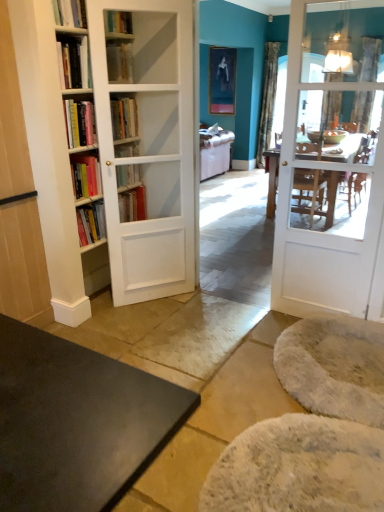
Question: From the image's perspective, is hardcover book at upper center above or below white fluffy yoga mat at lower right, positioned as the 1th yoga mat in back-to-front order?

Choices:
 (A) above
 (B) below

Answer: (A)

Question: In terms of height, does hardcover book at upper center look taller or shorter compared to white fluffy yoga mat at lower right, the second yoga mat positioned from the front?

Choices:
 (A) tall
 (B) short

Answer: (A)

Question: Which object is positioned farthest from the suede-like gray couch at center?

Choices:
 (A) metallic glass lampshade at upper right
 (B) silky teal curtain at upper right
 (C) hardcover book at upper center
 (D) light brown wood cabinet at left
 (E) matte black portrait at upper center

Answer: (D)

Question: Based on their relative distances, which object is nearer to the silky teal curtain at upper right?

Choices:
 (A) white wooden door at right
 (B) hardcover book at upper center
 (C) white fluffy yoga mat at lower right, the second yoga mat positioned from the front
 (D) light brown wood cabinet at left
 (E) metallic glass lampshade at upper right

Answer: (E)